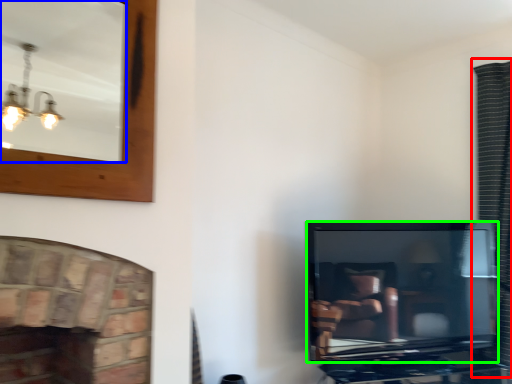
Question: Which is farther away from curtain (highlighted by a red box)? mirror (highlighted by a blue box) or television (highlighted by a green box)?

Choices:
 (A) mirror
 (B) television

Answer: (A)